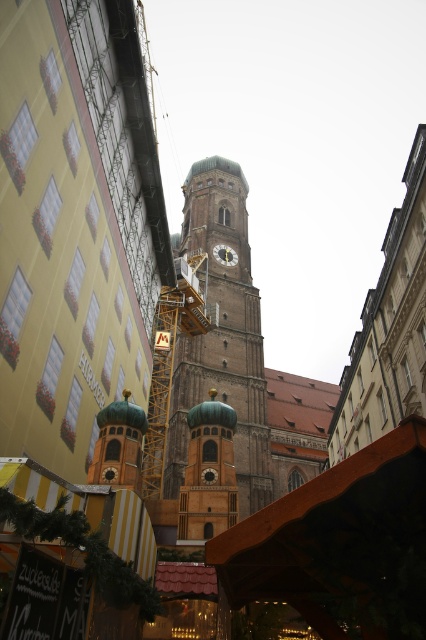
You are standing in the bustling urban scene with the historic church tower. You notice two points marked in the image. Which point, point 1 at coordinates (227,349) or point 2 at (215,250), is closer to you?

Point 1 at coordinates (227,349) is closer to the viewer than point 2 at (215,250).

You are standing at the entrance of the market stall with striped yellow and white awnings. You want to take a photo of the gold domed bell tower at center. In which direction should you point your camera?

The gold domed bell tower at center is located at point (x=207, y=474), so you should point your camera towards the center of the image to capture it.

You are an architect designing a new city square and want to ensure that the gold metallic clock at center is visible from the market stall. Given the gold domed bell tower at center is between them, will the clock be visible? Explain your reasoning based on their sizes.

The gold domed bell tower at center is wider than the gold metallic clock at center. Since the bell tower is between the clock and the market stall, its larger width may block the view of the clock depending on their exact positions and distances. However, without specific distance information, we can infer that the clock might still be partially visible if positioned higher or offset to one side.